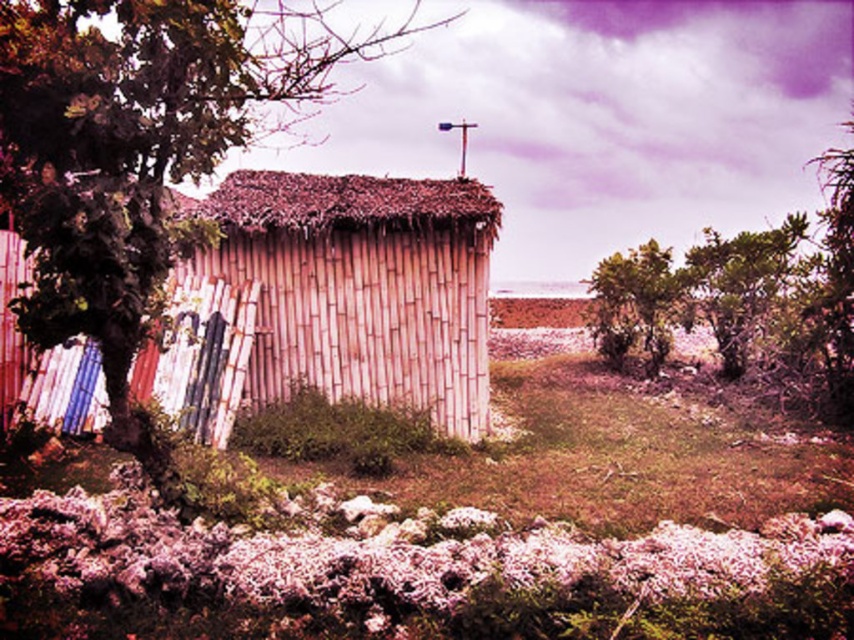
You are standing at the entrance of the rustic structure and want to place a picnic basket between the purple fuzzy flowers at lower center and the green leafy tree at upper right. How far apart are these two objects from each other?

The purple fuzzy flowers at lower center is 10.93 meters away from green leafy tree at upper right, so the picnic basket should be placed between them at that distance.

You are standing in front of the rustic structure and want to pick a flower from the purple fuzzy flowers at lower center and then walk to the green leafy tree at upper right. Which direction should you move first after picking the flowers?

After picking the purple fuzzy flowers at lower center, you should move towards the upper right direction to reach the green leafy tree at upper right since the tree is located in that direction from the flowers.